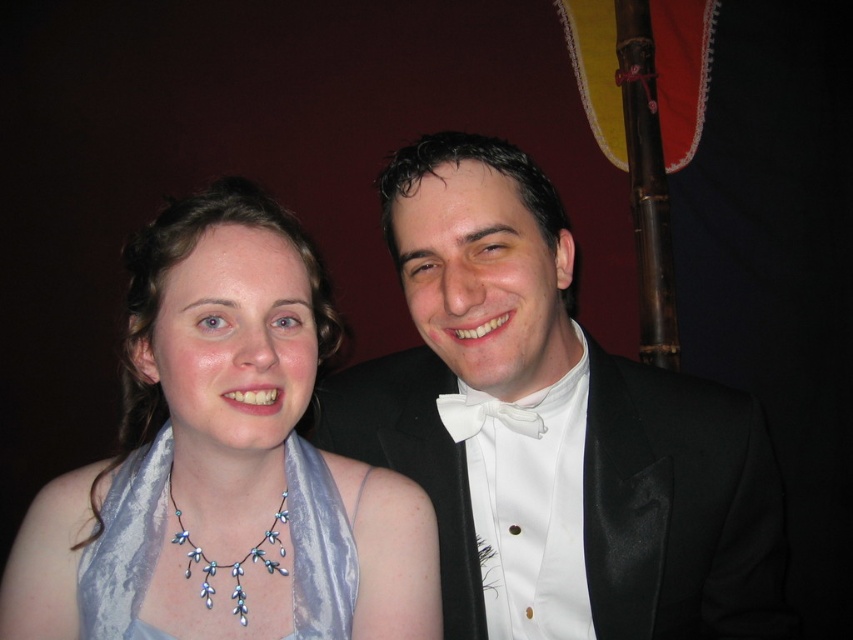
Does black satin tuxedo at center have a greater height compared to silvery satin scarf at left?

Yes, black satin tuxedo at center is taller than silvery satin scarf at left.

Locate an element on the screen. black satin tuxedo at center is located at coordinates (555, 422).

Between satin scarf at left and silvery satin scarf at left, which one is positioned lower?

silvery satin scarf at left is lower down.

The height and width of the screenshot is (640, 853). In order to click on satin scarf at left in this screenshot , I will do `click(224, 465)`.

This screenshot has height=640, width=853. I want to click on satin scarf at left, so click(224, 465).

Does silvery satin scarf at left have a lesser width compared to white satin bow tie at center?

In fact, silvery satin scarf at left might be wider than white satin bow tie at center.

Does silvery satin scarf at left have a smaller size compared to white satin bow tie at center?

Incorrect, silvery satin scarf at left is not smaller in size than white satin bow tie at center.

This screenshot has height=640, width=853. Identify the location of silvery satin scarf at left. (126, 545).

In order to click on silvery satin scarf at left in this screenshot , I will do `click(126, 545)`.